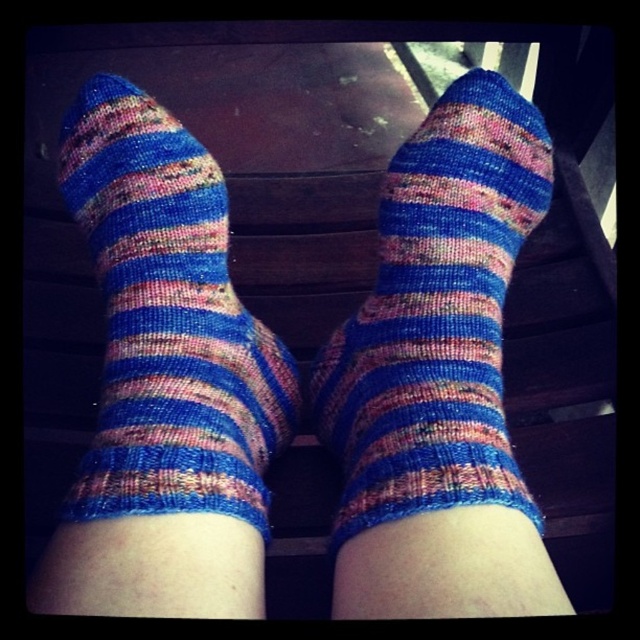
Consider the image. You are trying to decide which sock to wear today. You have a blue striped sock at center and a multicolored knitted sock at center. Which sock is wider?

The blue striped sock at center is wider than the multicolored knitted sock at center.

You are trying to decide which sock to wear today. You have a blue striped sock at center and a multicolored knitted sock at center. If you want to wear the one that is bigger, which one should you choose?

The blue striped sock at center has a larger size compared to the multicolored knitted sock at center, so you should choose the blue striped sock at center.